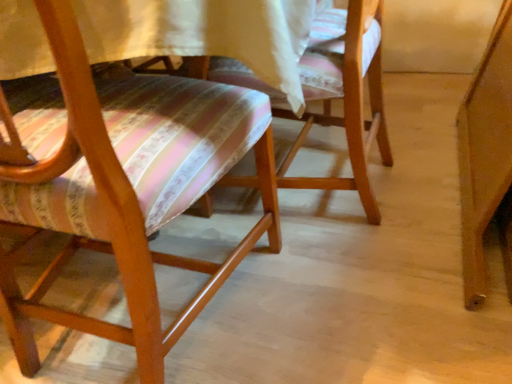
Question: Based on their positions, is wooden chair at center, acting as the 1th chair starting from the right, located to the left or right of wooden chair with striped cushion at left, the 1th chair positioned from the left?

Choices:
 (A) right
 (B) left

Answer: (A)

Question: Is wooden chair at center, the second chair viewed from the left, inside the boundaries of wooden chair with striped cushion at left, the 2th chair in the right-to-left sequence, or outside?

Choices:
 (A) inside
 (B) outside

Answer: (B)

Question: From a real-world perspective, is wooden chair at center, the second chair viewed from the left, above or below wooden chair with striped cushion at left, the 1th chair positioned from the left?

Choices:
 (A) below
 (B) above

Answer: (A)

Question: Is wooden chair with striped cushion at left, the 1th chair positioned from the left, in front of or behind wooden chair at center, acting as the 1th chair starting from the right, in the image?

Choices:
 (A) front
 (B) behind

Answer: (A)

Question: Considering the positions of point click(266, 178) and point click(388, 144), is point click(266, 178) closer or farther from the camera than point click(388, 144)?

Choices:
 (A) closer
 (B) farther

Answer: (A)

Question: From a real-world perspective, relative to wooden chair at center, the second chair viewed from the left, is wooden chair with striped cushion at left, the 1th chair positioned from the left, vertically above or below?

Choices:
 (A) above
 (B) below

Answer: (A)

Question: From the image's perspective, is wooden chair with striped cushion at left, the 1th chair positioned from the left, located above or below wooden chair at center, the second chair viewed from the left?

Choices:
 (A) above
 (B) below

Answer: (B)